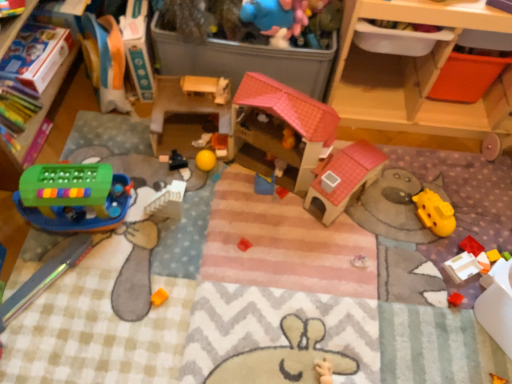
Where is `free space on the front side of yellow rubber ball at center, the fifth toy in the right-to-left sequence`? free space on the front side of yellow rubber ball at center, the fifth toy in the right-to-left sequence is located at coordinates (179, 201).